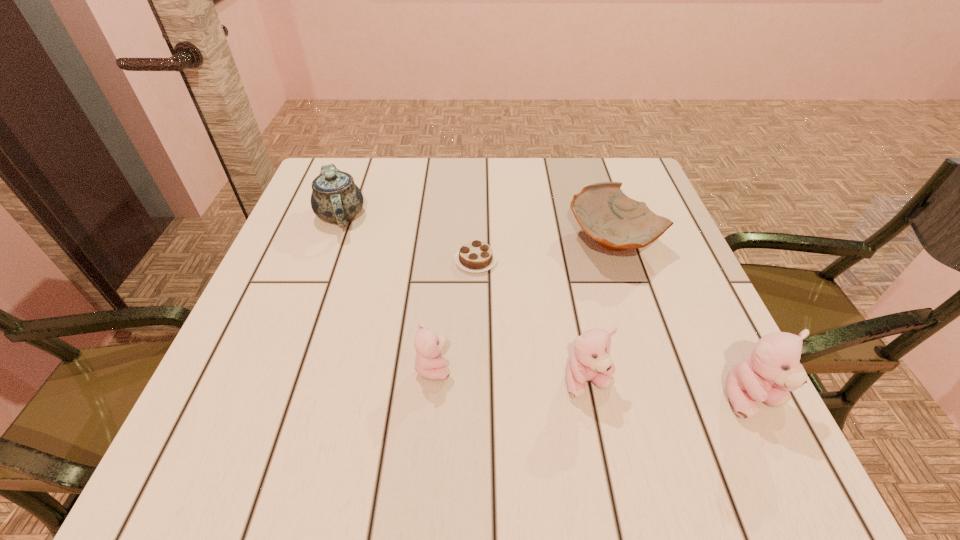
In the image, there is a desktop. At what (x,y) coordinates should I click in order to perform the action: click on vacant space at the right edge. Please return your answer as a coordinate pair (x, y). Looking at the image, I should click on tap(661, 325).

The image size is (960, 540). I want to click on free space that is in between the rightmost teddy bear and the chinaware, so click(546, 307).

The image size is (960, 540). Identify the location of free spot between the leftmost teddy bear and the second teddy bear from left to right. (511, 375).

I want to click on vacant area between the pottery and the shortest object, so click(545, 251).

You are a GUI agent. You are given a task and a screenshot of the screen. Output one action in this format:
    pyautogui.click(x=<x>, y=<y>)
    Task: Click on the free space between the chinaware and the shortest object
    This screenshot has height=540, width=960.
    Given the screenshot: What is the action you would take?
    pyautogui.click(x=408, y=238)

Find the location of a particular element. vacant space that is in between the shortest teddy bear and the pottery is located at coordinates (523, 304).

You are a GUI agent. You are given a task and a screenshot of the screen. Output one action in this format:
    pyautogui.click(x=<x>, y=<y>)
    Task: Click on the empty location between the second shortest teddy bear and the tallest object
    The width and height of the screenshot is (960, 540).
    Given the screenshot: What is the action you would take?
    pyautogui.click(x=670, y=390)

Locate an element on the screen. The image size is (960, 540). object that stands as the second closest to the second shortest teddy bear is located at coordinates (429, 364).

Where is `object that is the second closest to the pottery`? The width and height of the screenshot is (960, 540). object that is the second closest to the pottery is located at coordinates (590, 361).

Find the location of a particular element. The width and height of the screenshot is (960, 540). teddy bear that stands as the third closest to the leftmost object is located at coordinates (773, 368).